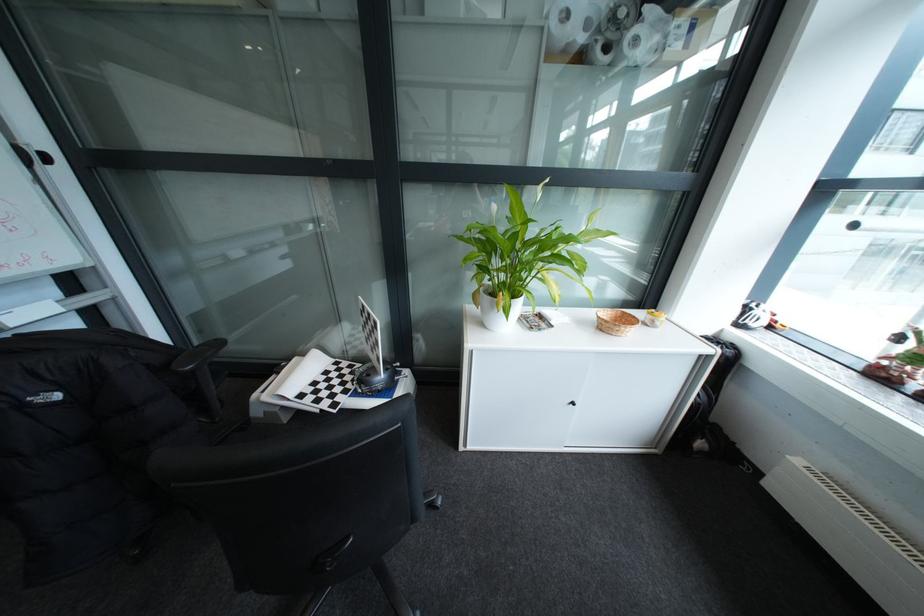
The height and width of the screenshot is (616, 924). Find the location of `small lidded jar`. small lidded jar is located at coordinates (653, 318).